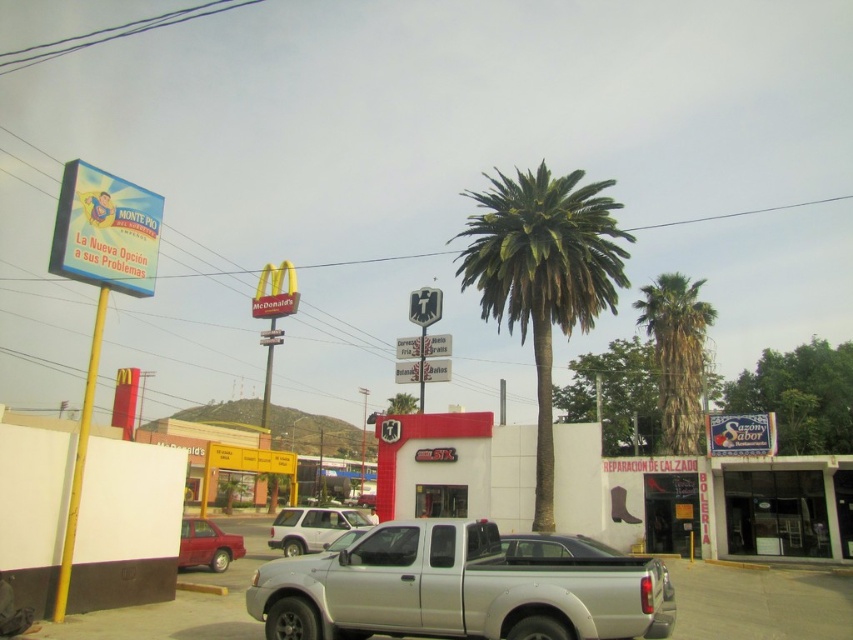
Is green leafy palm tree at center-right to the right of metallic red sedan at lower left from the viewer's perspective?

Correct, you'll find green leafy palm tree at center-right to the right of metallic red sedan at lower left.

Which is above, green leafy palm tree at center-right or metallic red sedan at lower left?

Positioned higher is green leafy palm tree at center-right.

From the picture: Measure the distance between green leafy palm tree at center-right and camera.

green leafy palm tree at center-right is 34.29 meters from camera.

Find the location of `green leafy palm tree at center-right`. green leafy palm tree at center-right is located at coordinates (676, 355).

What do you see at coordinates (311, 528) in the screenshot? I see `white matte suv at center` at bounding box center [311, 528].

Is white matte suv at center smaller than metallic red sedan at lower left?

Actually, white matte suv at center might be larger than metallic red sedan at lower left.

The height and width of the screenshot is (640, 853). What do you see at coordinates (311, 528) in the screenshot?
I see `white matte suv at center` at bounding box center [311, 528].

The height and width of the screenshot is (640, 853). I want to click on white matte suv at center, so click(x=311, y=528).

Does silver metallic pickup truck at center appear over metallic red sedan at lower left?

Indeed, silver metallic pickup truck at center is positioned over metallic red sedan at lower left.

Does silver metallic pickup truck at center have a lesser height compared to metallic red sedan at lower left?

Yes, silver metallic pickup truck at center is shorter than metallic red sedan at lower left.

Describe the element at coordinates (457, 589) in the screenshot. This screenshot has width=853, height=640. I see `silver metallic pickup truck at center` at that location.

Find the location of `silver metallic pickup truck at center`. silver metallic pickup truck at center is located at coordinates pyautogui.click(x=457, y=589).